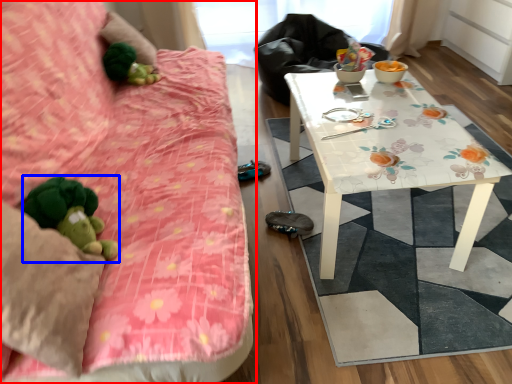
Question: Which point is further to the camera, studio couch (highlighted by a red box) or toy (highlighted by a blue box)?

Choices:
 (A) studio couch
 (B) toy

Answer: (B)